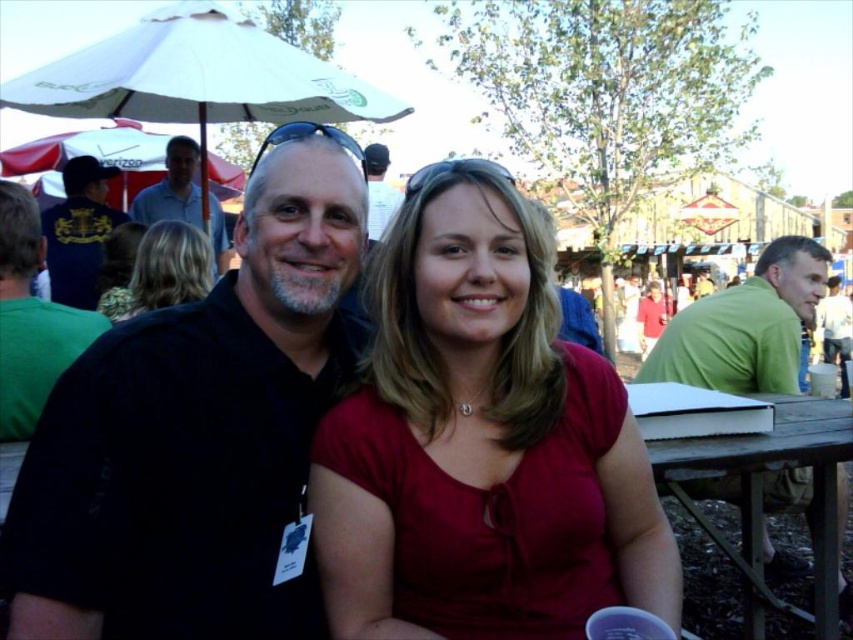
Question: Does red fabric umbrella at upper left appear under matte black shirt at center?

Choices:
 (A) yes
 (B) no

Answer: (B)

Question: Which of the following is the closest to the observer?

Choices:
 (A) (131, 161)
 (B) (242, 243)
 (C) (393, 193)
 (D) (140, 44)

Answer: (B)

Question: Which point appears closest to the camera in this image?

Choices:
 (A) (293, 577)
 (B) (65, 272)

Answer: (A)

Question: Which point is closer to the camera?

Choices:
 (A) red fabric umbrella at upper left
 (B) light blue shirt at upper left
 (C) black matte shirt at center

Answer: (C)

Question: Is dark blue shirt at left thinner than matte black shirt at center?

Choices:
 (A) no
 (B) yes

Answer: (A)

Question: Is black matte shirt at center in front of green cotton shirt at left?

Choices:
 (A) no
 (B) yes

Answer: (B)